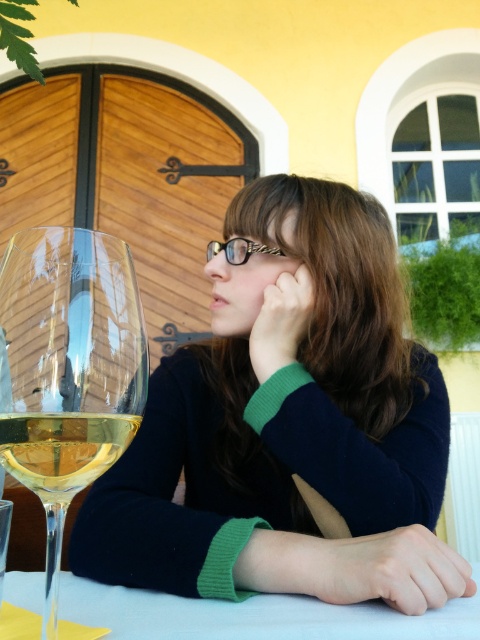
You are a photographer trying to capture the reflection of the wine glass in the scene. The reflection is visible at point A on the translucent glass wine at lower left. Where would you position your camera relative to the light source to best capture this reflection?

To capture the reflection at point A on the translucent glass wine at lower left, position your camera directly opposite the light source so that the light reflects off the glass surface toward the camera lens. This ensures the reflection is clearly visible in the photograph.

You are standing at the origin point in the image. Can you determine the direction of the white glossy table at lower center relative to your position?

The white glossy table at lower center is located at point 0.963 on the x axis and 0.533 on the y axis, so it is to the right and slightly above your current position at the origin.

You are setting up a small decorative item that requires 10 cm of space. You have the transparent glass wine glass at lower left and the white glossy table at lower center. Which object can accommodate this item based on their widths?

The white glossy table at lower center can accommodate the decorative item since its width is greater than the transparent glass wine glass at lower left, which is insufficient for the required 10 cm space.